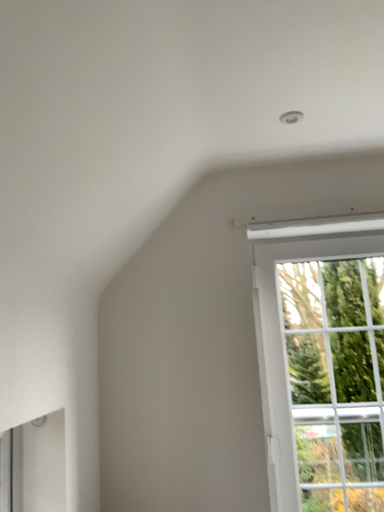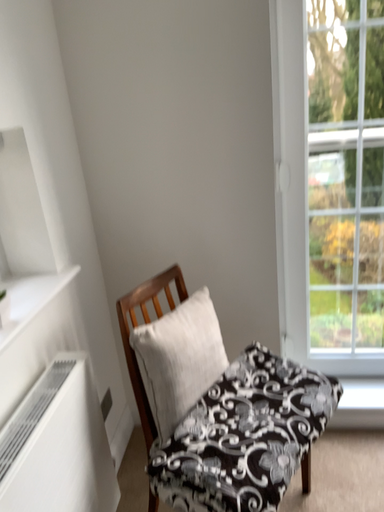
Question: How did the camera likely rotate when shooting the video?

Choices:
 (A) rotated upward
 (B) rotated downward

Answer: (B)